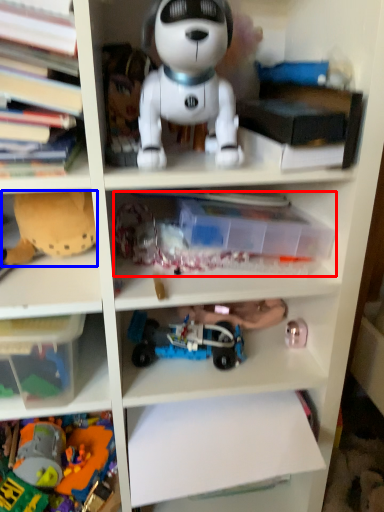
Question: Which of the following is the closest to the observer, book (highlighted by a red box) or toy (highlighted by a blue box)?

Choices:
 (A) book
 (B) toy

Answer: (A)